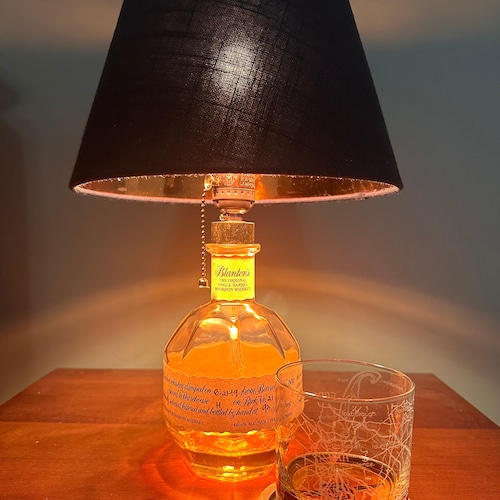
The height and width of the screenshot is (500, 500). I want to click on hazy lightbulb, so click(236, 62).